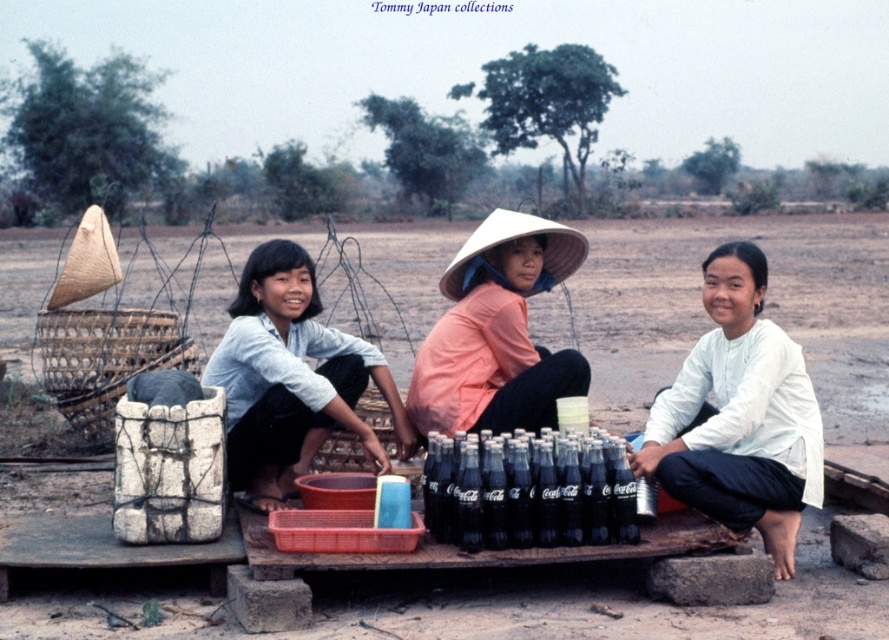
Based on the photo, you are a customer approaching the platform to buy a drink. Which object will you see first when looking at the white cotton shirt at center and the black glass bottles at center?

The white cotton shirt at center will be seen first because the black glass bottles at center are positioned behind it.